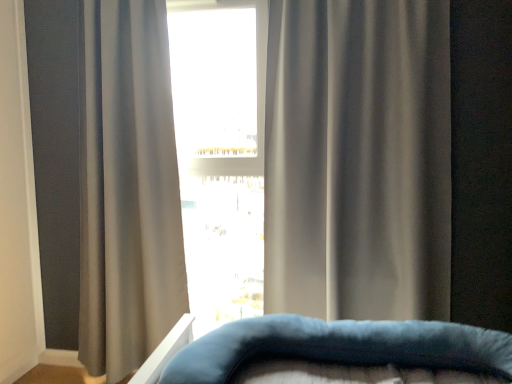
What do you see at coordinates (220, 153) in the screenshot? The image size is (512, 384). I see `white glossy window at center` at bounding box center [220, 153].

What do you see at coordinates (358, 159) in the screenshot? Image resolution: width=512 pixels, height=384 pixels. I see `satin gray curtain at center, which ranks as the second curtain in left-to-right order` at bounding box center [358, 159].

At what (x,y) coordinates should I click in order to perform the action: click on white glossy window at center. Please return your answer as a coordinate pair (x, y). Image resolution: width=512 pixels, height=384 pixels. Looking at the image, I should click on (220, 153).

Considering the sizes of objects satin gray curtain at center, placed as the first curtain when sorted from right to left, and gray matte curtain at center, the 2th curtain viewed from the right, in the image provided, who is taller, satin gray curtain at center, placed as the first curtain when sorted from right to left, or gray matte curtain at center, the 2th curtain viewed from the right,?

gray matte curtain at center, the 2th curtain viewed from the right, is taller.

Is satin gray curtain at center, which ranks as the second curtain in left-to-right order, to the right of gray matte curtain at center, placed as the 1th curtain when sorted from left to right, from the viewer's perspective?

Indeed, satin gray curtain at center, which ranks as the second curtain in left-to-right order, is positioned on the right side of gray matte curtain at center, placed as the 1th curtain when sorted from left to right.

Is satin gray curtain at center, placed as the first curtain when sorted from right to left, surrounding gray matte curtain at center, the 2th curtain viewed from the right?

No, gray matte curtain at center, the 2th curtain viewed from the right, is not inside satin gray curtain at center, placed as the first curtain when sorted from right to left.

How far apart are satin gray curtain at center, placed as the first curtain when sorted from right to left, and gray matte curtain at center, the 2th curtain viewed from the right?

The distance of satin gray curtain at center, placed as the first curtain when sorted from right to left, from gray matte curtain at center, the 2th curtain viewed from the right, is 38.23 inches.

Which of these two, satin gray curtain at center, placed as the first curtain when sorted from right to left, or velvety blue pillow at center, stands shorter?

With less height is velvety blue pillow at center.

Who is more distant, satin gray curtain at center, placed as the first curtain when sorted from right to left, or velvety blue pillow at center?

satin gray curtain at center, placed as the first curtain when sorted from right to left, is further from the camera.

Is satin gray curtain at center, placed as the first curtain when sorted from right to left, facing towards velvety blue pillow at center?

Yes, satin gray curtain at center, placed as the first curtain when sorted from right to left, is aimed at velvety blue pillow at center.

Measure the distance between satin gray curtain at center, placed as the first curtain when sorted from right to left, and velvety blue pillow at center.

satin gray curtain at center, placed as the first curtain when sorted from right to left, and velvety blue pillow at center are 37.20 inches apart.

Does white glossy window at center have a larger size compared to gray matte curtain at center, placed as the 1th curtain when sorted from left to right?

Incorrect, white glossy window at center is not larger than gray matte curtain at center, placed as the 1th curtain when sorted from left to right.

Is white glossy window at center positioned in front of gray matte curtain at center, placed as the 1th curtain when sorted from left to right?

No, it is behind gray matte curtain at center, placed as the 1th curtain when sorted from left to right.

Starting from the white glossy window at center, which curtain is the 1st one in front? Please provide its 2D coordinates.

[(128, 189)]

Between velvety blue pillow at center and satin gray curtain at center, placed as the first curtain when sorted from right to left, which one appears on the right side from the viewer's perspective?

Positioned to the right is satin gray curtain at center, placed as the first curtain when sorted from right to left.

Measure the distance between velvety blue pillow at center and satin gray curtain at center, placed as the first curtain when sorted from right to left.

velvety blue pillow at center and satin gray curtain at center, placed as the first curtain when sorted from right to left, are 37.20 inches apart from each other.

Which object is further away from the camera taking this photo, velvety blue pillow at center or satin gray curtain at center, which ranks as the second curtain in left-to-right order?

satin gray curtain at center, which ranks as the second curtain in left-to-right order.

Which is behind, point (152, 364) or point (353, 275)?

The point (353, 275) is more distant.

From a real-world perspective, is gray matte curtain at center, the 2th curtain viewed from the right, positioned above or below satin gray curtain at center, which ranks as the second curtain in left-to-right order?

In terms of real-world spatial position, gray matte curtain at center, the 2th curtain viewed from the right, is below satin gray curtain at center, which ranks as the second curtain in left-to-right order.

From the image's perspective, which one is positioned higher, gray matte curtain at center, placed as the 1th curtain when sorted from left to right, or satin gray curtain at center, placed as the first curtain when sorted from right to left?

satin gray curtain at center, placed as the first curtain when sorted from right to left, is shown above in the image.

Can satin gray curtain at center, placed as the first curtain when sorted from right to left, be found inside gray matte curtain at center, the 2th curtain viewed from the right?

No.

Considering the sizes of objects gray matte curtain at center, placed as the 1th curtain when sorted from left to right, and satin gray curtain at center, placed as the first curtain when sorted from right to left, in the image provided, who is bigger, gray matte curtain at center, placed as the 1th curtain when sorted from left to right, or satin gray curtain at center, placed as the first curtain when sorted from right to left,?

With larger size is satin gray curtain at center, placed as the first curtain when sorted from right to left.

Which of these two, gray matte curtain at center, placed as the 1th curtain when sorted from left to right, or white glossy window at center, stands shorter?

Standing shorter between the two is white glossy window at center.

Can you confirm if gray matte curtain at center, the 2th curtain viewed from the right, is positioned to the left of white glossy window at center?

Correct, you'll find gray matte curtain at center, the 2th curtain viewed from the right, to the left of white glossy window at center.

How different are the orientations of gray matte curtain at center, the 2th curtain viewed from the right, and white glossy window at center in degrees?

The angular difference between gray matte curtain at center, the 2th curtain viewed from the right, and white glossy window at center is 0.178 degrees.

Looking at this image, is white glossy window at center at the back of gray matte curtain at center, placed as the 1th curtain when sorted from left to right?

gray matte curtain at center, placed as the 1th curtain when sorted from left to right, does not have its back to white glossy window at center.

Can you confirm if gray matte curtain at center, the 2th curtain viewed from the right, is thinner than velvety blue pillow at center?

Yes, gray matte curtain at center, the 2th curtain viewed from the right, is thinner than velvety blue pillow at center.

Would you say gray matte curtain at center, the 2th curtain viewed from the right, is to the left or to the right of velvety blue pillow at center in the picture?

In the image, gray matte curtain at center, the 2th curtain viewed from the right, appears on the left side of velvety blue pillow at center.

Is gray matte curtain at center, the 2th curtain viewed from the right, turned away from velvety blue pillow at center?

No.

From the image's perspective, would you say gray matte curtain at center, the 2th curtain viewed from the right, is shown under velvety blue pillow at center?

Incorrect, from the image's perspective, gray matte curtain at center, the 2th curtain viewed from the right, is higher than velvety blue pillow at center.

You are a GUI agent. You are given a task and a screenshot of the screen. Output one action in this format:
    pyautogui.click(x=<x>, y=<y>)
    Task: Click on the curtain below the satin gray curtain at center, which ranks as the second curtain in left-to-right order (from a real-world perspective)
    The image size is (512, 384).
    Given the screenshot: What is the action you would take?
    pyautogui.click(x=128, y=189)

What are the coordinates of `the 2nd curtain positioned above the velvety blue pillow at center (from the image's perspective)` in the screenshot? It's located at (358, 159).

Estimate the real-world distances between objects in this image. Which object is further from velvety blue pillow at center, gray matte curtain at center, placed as the 1th curtain when sorted from left to right, or white glossy window at center?

Based on the image, white glossy window at center appears to be further to velvety blue pillow at center.

When comparing their distances from satin gray curtain at center, placed as the first curtain when sorted from right to left, does velvety blue pillow at center or gray matte curtain at center, placed as the 1th curtain when sorted from left to right, seem closer?

velvety blue pillow at center.

Estimate the real-world distances between objects in this image. Which object is closer to velvety blue pillow at center, gray matte curtain at center, placed as the 1th curtain when sorted from left to right, or satin gray curtain at center, which ranks as the second curtain in left-to-right order?

The object closer to velvety blue pillow at center is satin gray curtain at center, which ranks as the second curtain in left-to-right order.

From the image, which object appears to be farther from white glossy window at center, gray matte curtain at center, placed as the 1th curtain when sorted from left to right, or satin gray curtain at center, which ranks as the second curtain in left-to-right order?

satin gray curtain at center, which ranks as the second curtain in left-to-right order, is further to white glossy window at center.

Considering their positions, is satin gray curtain at center, which ranks as the second curtain in left-to-right order, positioned further to gray matte curtain at center, placed as the 1th curtain when sorted from left to right, than velvety blue pillow at center?

velvety blue pillow at center lies further to gray matte curtain at center, placed as the 1th curtain when sorted from left to right, than the other object.

When comparing their distances from white glossy window at center, does satin gray curtain at center, placed as the first curtain when sorted from right to left, or gray matte curtain at center, the 2th curtain viewed from the right, seem further?

satin gray curtain at center, placed as the first curtain when sorted from right to left, lies further to white glossy window at center than the other object.

Looking at the image, which one is located closer to satin gray curtain at center, placed as the first curtain when sorted from right to left, velvety blue pillow at center or white glossy window at center?

white glossy window at center is closer to satin gray curtain at center, placed as the first curtain when sorted from right to left.

In the scene shown: Estimate the real-world distances between objects in this image. Which object is further from white glossy window at center, velvety blue pillow at center or satin gray curtain at center, which ranks as the second curtain in left-to-right order?

Among the two, velvety blue pillow at center is located further to white glossy window at center.

Locate an element on the screen. furniture between gray matte curtain at center, the 2th curtain viewed from the right, and satin gray curtain at center, placed as the first curtain when sorted from right to left, from left to right is located at coordinates (330, 348).

Where is `bay window between gray matte curtain at center, the 2th curtain viewed from the right, and satin gray curtain at center, which ranks as the second curtain in left-to-right order, in the horizontal direction`? The height and width of the screenshot is (384, 512). bay window between gray matte curtain at center, the 2th curtain viewed from the right, and satin gray curtain at center, which ranks as the second curtain in left-to-right order, in the horizontal direction is located at coordinates (220, 153).